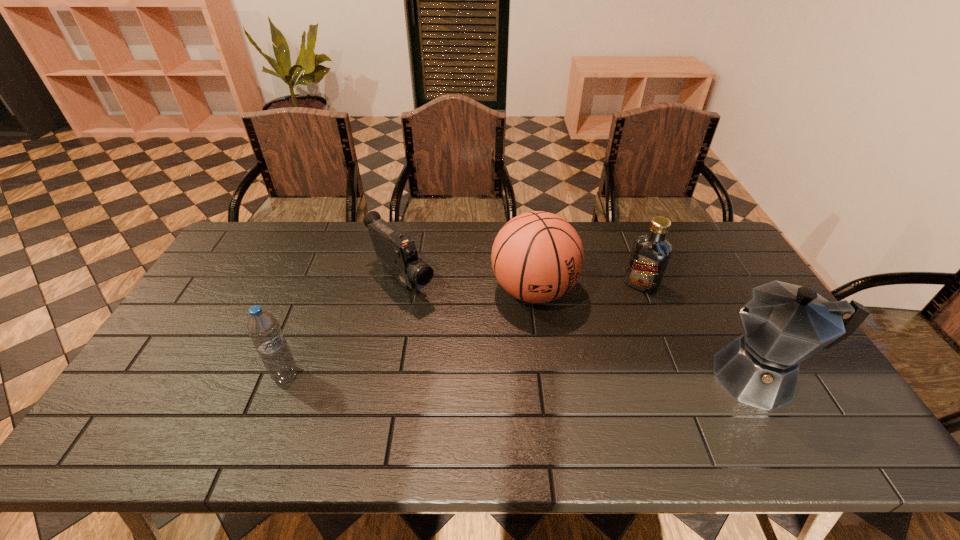
Locate an element on the screen. This screenshot has height=540, width=960. free spot on the desktop that is between the leftmost object and the coffeepot and is positioned on the front-facing side of the camcorder is located at coordinates (x=508, y=376).

Identify the location of vacant space on the desktop that is between the water bottle and the coffeepot and is positioned on the front-facing side of the vodka. (580, 376).

Where is `free spot on the desktop that is between the water bottle and the coffeepot and is positioned on the surface of the third object from left to right near the brand logo`? free spot on the desktop that is between the water bottle and the coffeepot and is positioned on the surface of the third object from left to right near the brand logo is located at coordinates (591, 376).